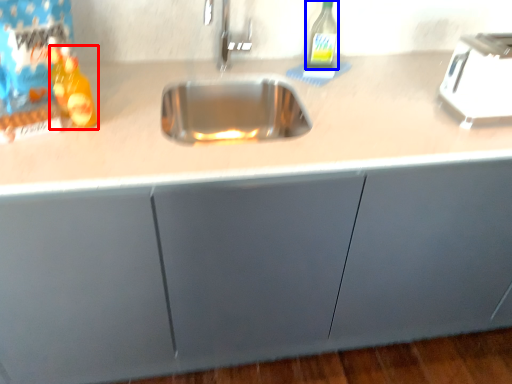
Question: Among these objects, which one is nearest to the camera, bottle (highlighted by a red box) or bottle (highlighted by a blue box)?

Choices:
 (A) bottle
 (B) bottle

Answer: (A)